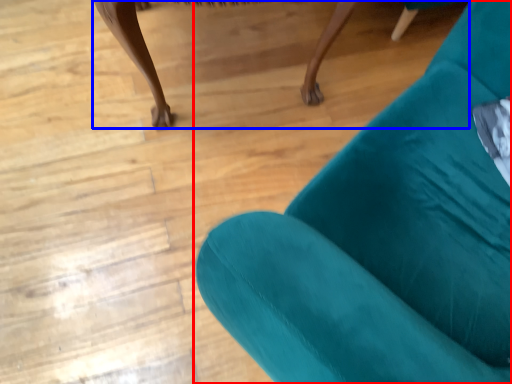
Question: Among these objects, which one is nearest to the camera, chair (highlighted by a red box) or furniture (highlighted by a blue box)?

Choices:
 (A) chair
 (B) furniture

Answer: (A)